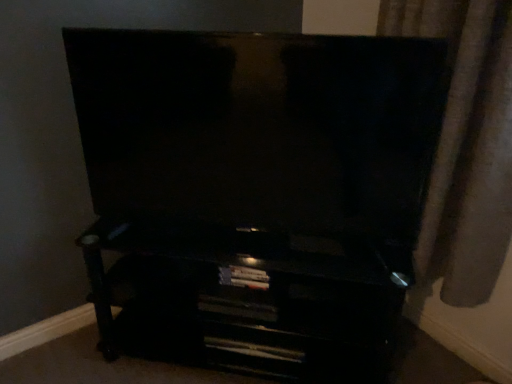
Find the location of a particular element. The height and width of the screenshot is (384, 512). blank space above black glossy entertainment center at lower center (from a real-world perspective) is located at coordinates (221, 240).